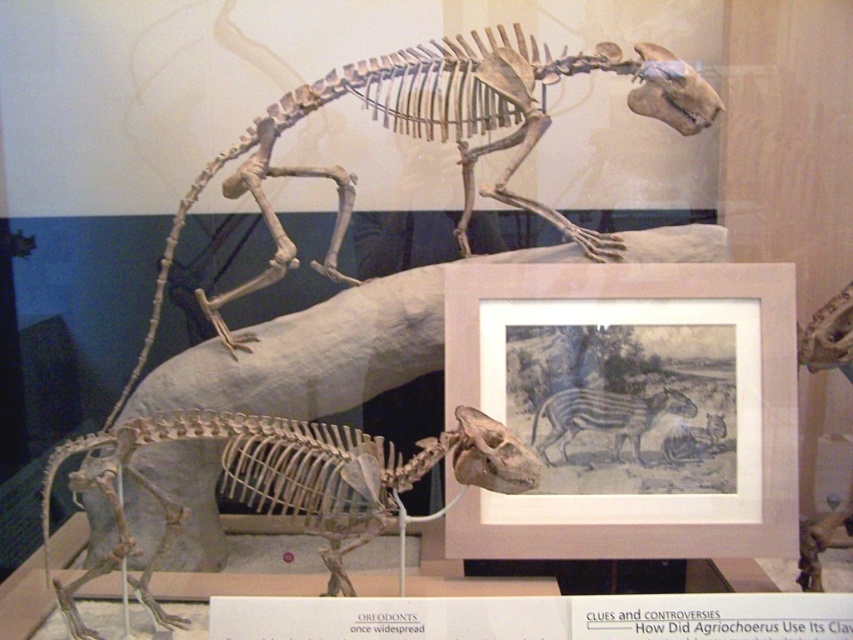
You are a visitor at this museum display and want to take a photo of both the matte paper picture frame at center and the gray textured zebra at center. Which object should you focus on first if you want to capture both in a single shot without moving your camera?

The matte paper picture frame at center is to the left of the gray textured zebra at center, so you should focus on the matte paper picture frame at center first to ensure both are in the frame.